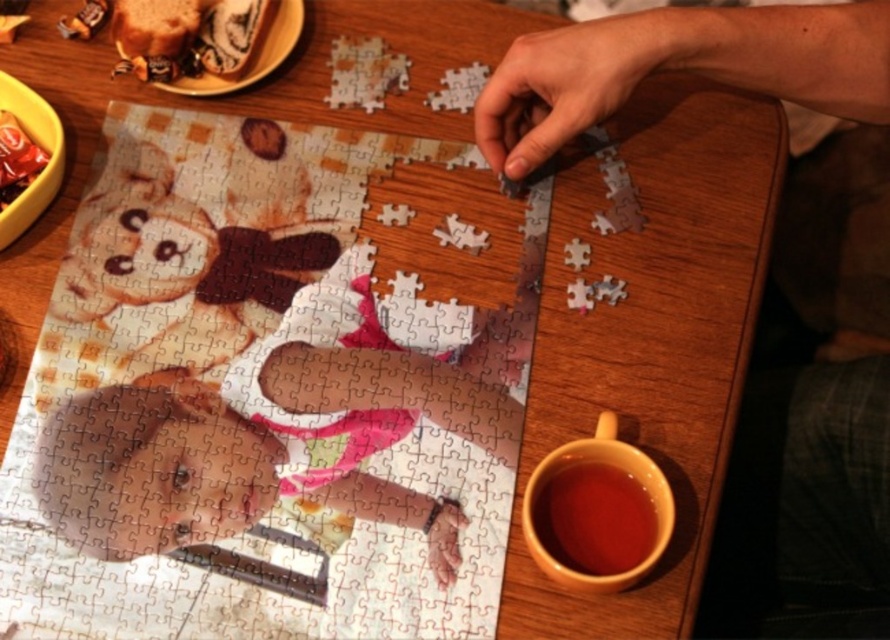
You are a person trying to place the smooth plastic baby at center onto the smooth skin hand at upper right. Can the baby fit into the hand?

The smooth plastic baby at center is taller than the smooth skin hand at upper right, so it cannot fit into the hand.

You are a person trying to pick up the smooth plastic baby at center without touching the smooth skin hand at upper right. Is this possible?

The smooth plastic baby at center is positioned under the smooth skin hand at upper right, so you can pick up the smooth plastic baby at center without moving the hand.

You are a person who wants to grab the matte ceramic mug at lower right without moving the smooth skin hand at upper right. Is this possible?

The matte ceramic mug at lower right is behind the smooth skin hand at upper right, so you can reach for the matte ceramic mug at lower right behind the hand to grab it without moving the smooth skin hand at upper right.